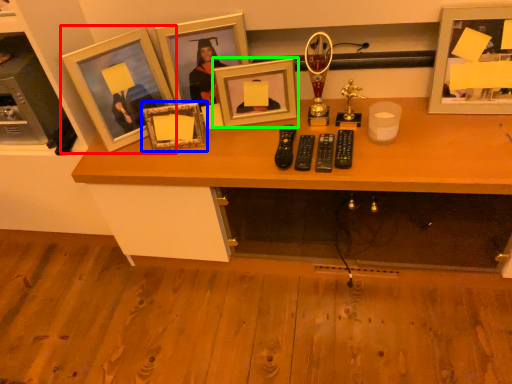
Question: Based on their relative distances, which object is farther from picture frame (highlighted by a red box)? Choose from picture frame (highlighted by a blue box) and picture frame (highlighted by a green box).

Choices:
 (A) picture frame
 (B) picture frame

Answer: (B)